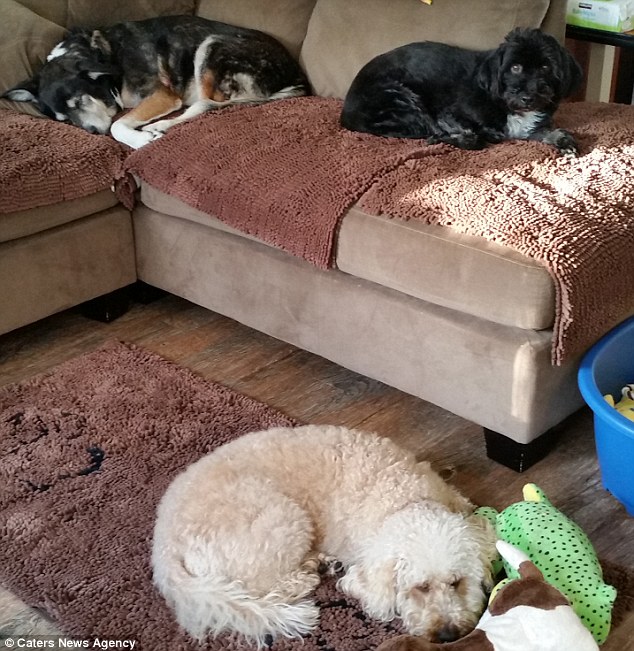
Image resolution: width=634 pixels, height=651 pixels. What are the coordinates of `towel` in the screenshot? It's located at (345, 137), (562, 262), (46, 158).